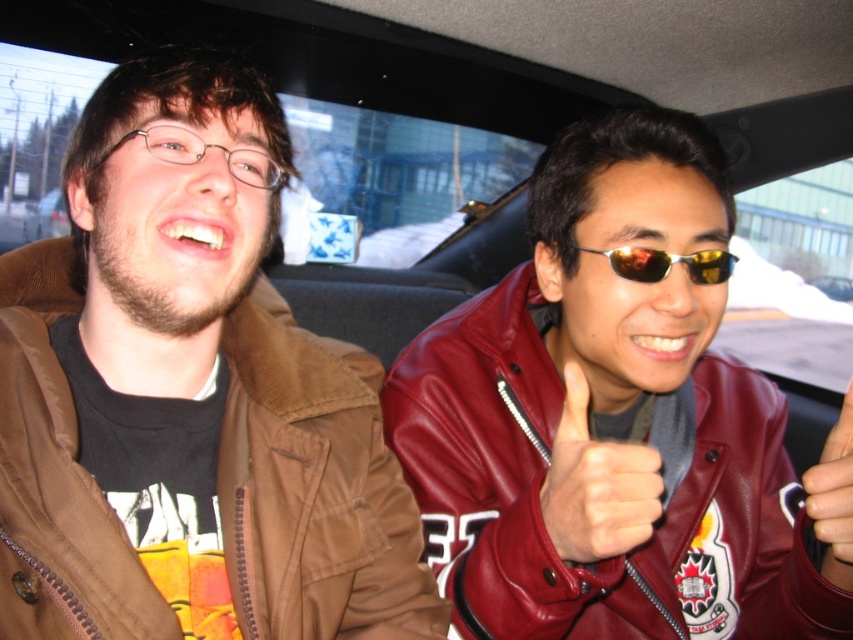
You are a passenger in the car and want to hand the metallic silver ring at upper right to the driver. Since the driver is wearing the gold reflective sunglasses at center, will you need to move the sunglasses first to give the ring?

The metallic silver ring at upper right is in front of the gold reflective sunglasses at center, so the sunglasses are behind the ring. Therefore, the driver does not need to move the sunglasses to receive the ring.

You are a passenger in the car and want to grab the metallic silver ring at upper right and the gold reflective sunglasses at center. Which object should you reach for first if you want to pick up the one closer to your current position?

The metallic silver ring at upper right is located below the gold reflective sunglasses at center, so it is closer to you. Therefore, you should reach for the metallic silver ring at upper right first.

You are a passenger in the car and want to hand a small gift to the driver. The gift is too big to fit in your pocket, so you need to place it somewhere visible but not blocking the driver. Which object, the leather at center or the metallic silver ring at upper right, should you place the gift near to ensure it stays in view without obstructing the driver?

The metallic silver ring at upper right is farther from the viewer than the leather at center. Placing the gift near the metallic silver ring at upper right would keep it visible but less likely to block the driver.